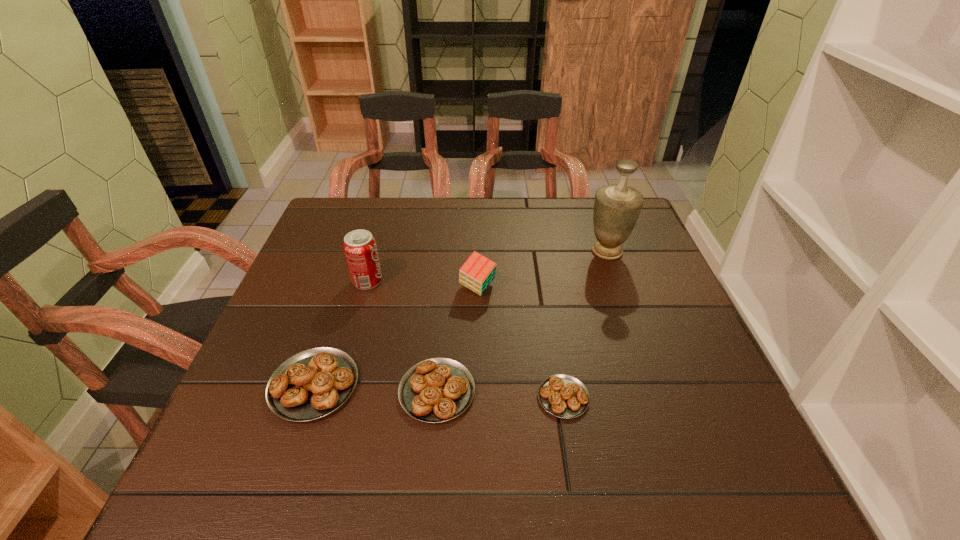
Find the location of a particular element. This screenshot has height=540, width=960. free spot between the second shortest pastry and the soda can is located at coordinates (402, 336).

Locate an element on the screen. The height and width of the screenshot is (540, 960). unoccupied area between the cube and the soda can is located at coordinates (422, 284).

This screenshot has width=960, height=540. In order to click on free space between the fifth object from left to right and the second shortest object in this screenshot , I will do `click(500, 394)`.

Where is `vacant space in between the leftmost pastry and the cube`? This screenshot has height=540, width=960. vacant space in between the leftmost pastry and the cube is located at coordinates (396, 336).

The image size is (960, 540). What are the coordinates of `free space that is in between the tallest object and the rightmost pastry` in the screenshot? It's located at (585, 324).

I want to click on object that ranks as the third closest to the farthest object, so click(435, 390).

Choose which object is the second nearest neighbor to the rightmost object. Please provide its 2D coordinates. Your answer should be formatted as a tuple, i.e. [(x, y)], where the tuple contains the x and y coordinates of a point satisfying the conditions above.

[(563, 396)]

Identify which pastry is the third closest to the second tallest object. Please provide its 2D coordinates. Your answer should be formatted as a tuple, i.e. [(x, y)], where the tuple contains the x and y coordinates of a point satisfying the conditions above.

[(563, 396)]

Locate which pastry is the second closest to the rightmost pastry. Please provide its 2D coordinates. Your answer should be formatted as a tuple, i.e. [(x, y)], where the tuple contains the x and y coordinates of a point satisfying the conditions above.

[(311, 384)]

In order to click on free space that satisfies the following two spatial constraints: 1. on the front side of the rightmost pastry; 2. on the left side of the leftmost pastry in this screenshot , I will do `click(310, 397)`.